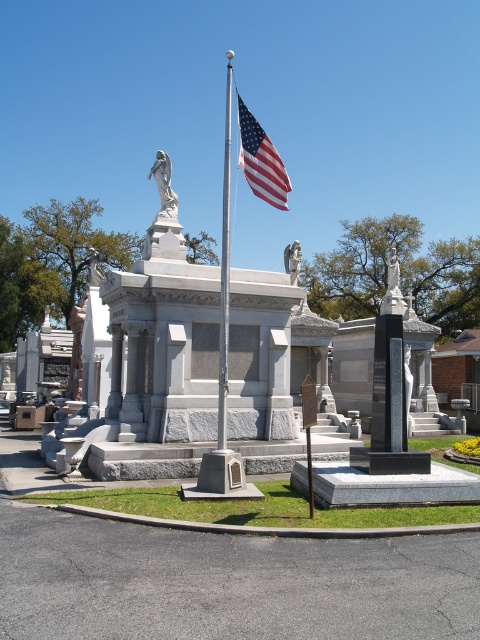
Question: Can you confirm if white marble statue at upper center is positioned to the left of white marble statue at center?

Choices:
 (A) no
 (B) yes

Answer: (B)

Question: Which point is closer to the camera?

Choices:
 (A) (283, 170)
 (B) (159, 157)
 (C) (225, 337)
 (D) (287, 264)

Answer: (C)

Question: Does american flag at center lie in front of white marble statue at upper center?

Choices:
 (A) yes
 (B) no

Answer: (A)

Question: Which is farther from the polished metal flagpole at center?

Choices:
 (A) american flag at center
 (B) white marble statue at center
 (C) white marble statue at upper center

Answer: (C)

Question: Is american flag at center positioned behind white marble statue at upper center?

Choices:
 (A) yes
 (B) no

Answer: (B)

Question: Which object appears closest to the camera in this image?

Choices:
 (A) polished metal flagpole at center
 (B) white marble statue at upper center
 (C) white marble statue at center

Answer: (A)